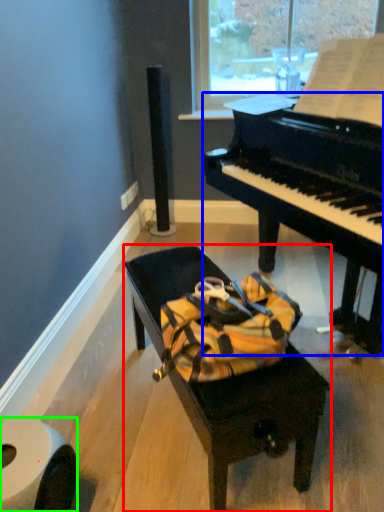
Question: Which is farther away from furniture (highlighted by a red box)? piano (highlighted by a blue box) or toilet paper (highlighted by a green box)?

Choices:
 (A) piano
 (B) toilet paper

Answer: (A)